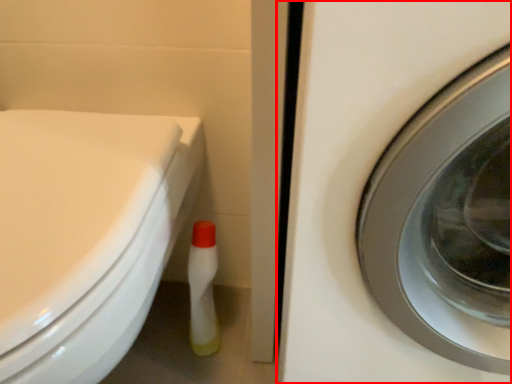
Question: From the image's perspective, where is washing machine (annotated by the red box) located relative to bidet?

Choices:
 (A) above
 (B) below

Answer: (A)